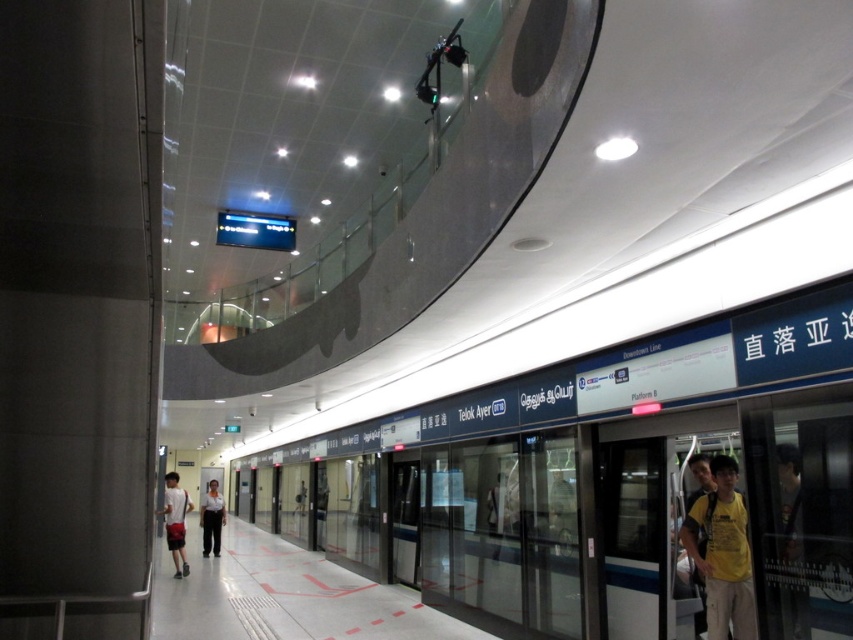
Question: Does yellow t-shirt at right appear on the right side of white fabric shirt at center?

Choices:
 (A) yes
 (B) no

Answer: (A)

Question: Where is yellow t-shirt at right located in relation to white fabric shirt at center in the image?

Choices:
 (A) above
 (B) below

Answer: (A)

Question: Which of these objects is positioned closest to the yellow t-shirt at right?

Choices:
 (A) white fabric shirt at center
 (B) white cotton t-shirt at lower left

Answer: (B)

Question: Does yellow t-shirt at right have a greater width compared to white cotton t-shirt at lower left?

Choices:
 (A) no
 (B) yes

Answer: (A)

Question: Which of the following is the farthest from the observer?

Choices:
 (A) (178, 497)
 (B) (708, 586)
 (C) (218, 525)

Answer: (C)

Question: Which point is farther to the camera?

Choices:
 (A) yellow t-shirt at right
 (B) white cotton t-shirt at lower left

Answer: (B)